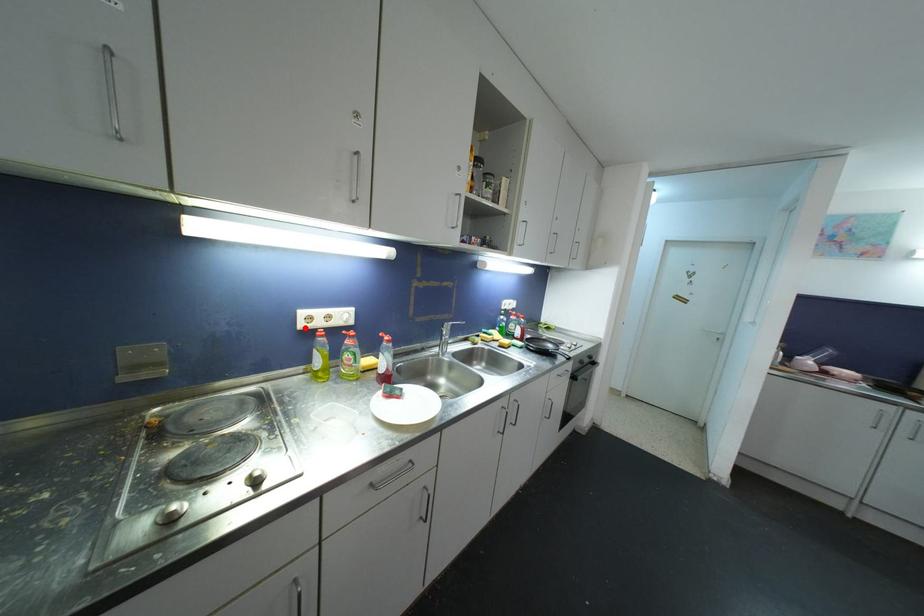
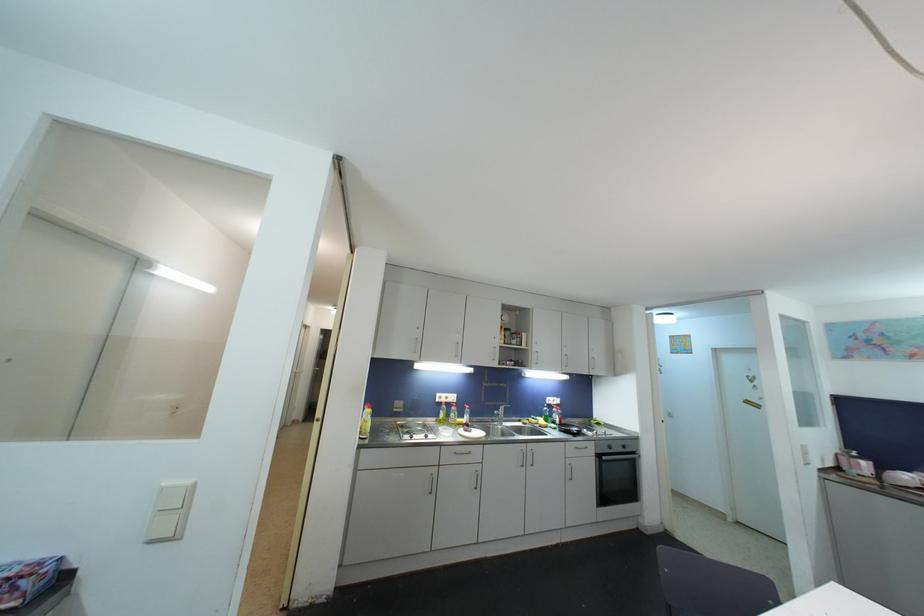
Question: I am providing you with two images of the same scene from different viewpoints. Image1 has a red point marked. In image2, the corresponding 3D location appears at what relative position? Reply with the corresponding letter.

Choices:
 (A) Closer
 (B) Farther

Answer: (B)